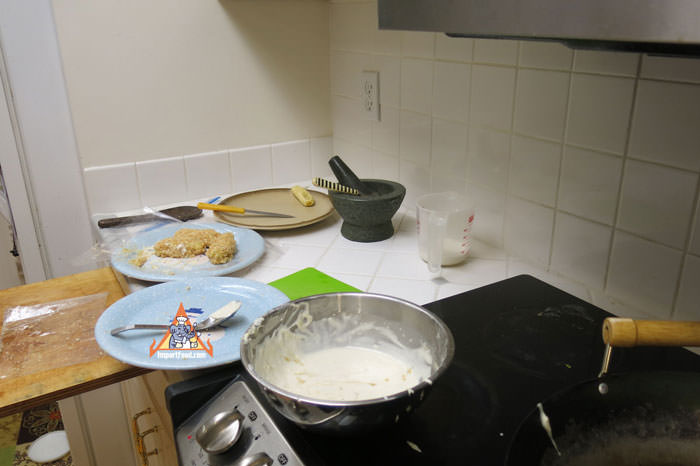
Find the location of a particular element. The width and height of the screenshot is (700, 466). stove is located at coordinates (547, 359).